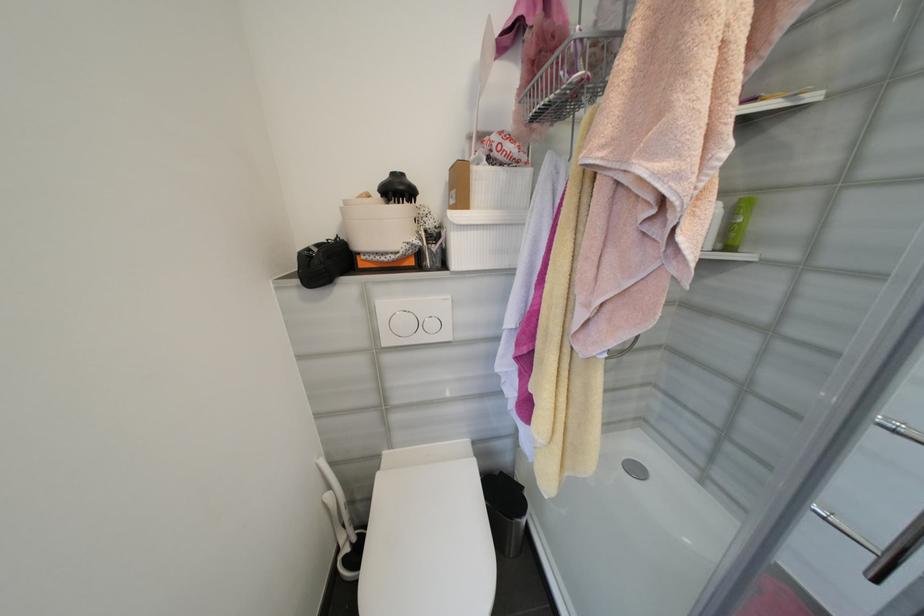
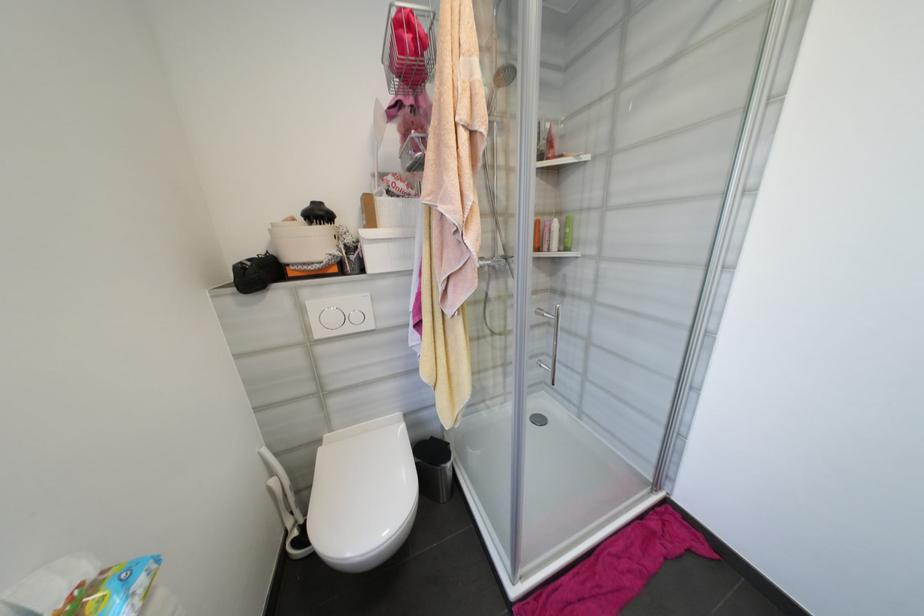
The point at (507, 476) is marked in the first image. Where is the corresponding point in the second image?

(438, 440)